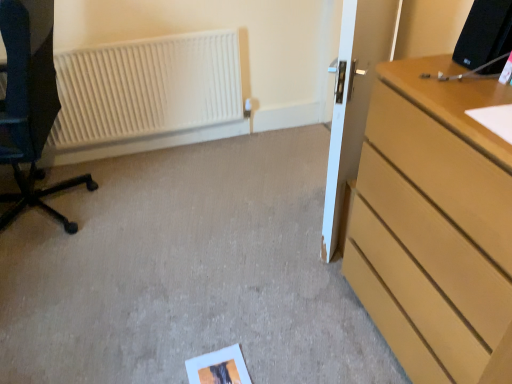
Question: From the image's perspective, is white glossy door at center on top of white matte radiator at upper left?

Choices:
 (A) no
 (B) yes

Answer: (A)

Question: Considering the relative sizes of white glossy door at center and white matte radiator at upper left in the image provided, is white glossy door at center thinner than white matte radiator at upper left?

Choices:
 (A) yes
 (B) no

Answer: (B)

Question: Is white glossy door at center positioned with its back to white matte radiator at upper left?

Choices:
 (A) no
 (B) yes

Answer: (A)

Question: Is white glossy door at center to the right of white matte radiator at upper left from the viewer's perspective?

Choices:
 (A) yes
 (B) no

Answer: (A)

Question: Would you consider white glossy door at center to be distant from white matte radiator at upper left?

Choices:
 (A) no
 (B) yes

Answer: (B)

Question: From the image's perspective, is matte black chair at left located above or below white glossy door at center?

Choices:
 (A) above
 (B) below

Answer: (A)

Question: Is matte black chair at left spatially inside white glossy door at center, or outside of it?

Choices:
 (A) outside
 (B) inside

Answer: (A)

Question: In terms of width, does matte black chair at left look wider or thinner when compared to white glossy door at center?

Choices:
 (A) thin
 (B) wide

Answer: (B)

Question: Relative to white glossy door at center, is matte black chair at left in front or behind?

Choices:
 (A) behind
 (B) front

Answer: (A)

Question: Looking at their shapes, would you say white matte radiator at upper left is wider or thinner than matte black chair at left?

Choices:
 (A) thin
 (B) wide

Answer: (A)

Question: Is white matte radiator at upper left bigger or smaller than matte black chair at left?

Choices:
 (A) small
 (B) big

Answer: (A)

Question: Is point (74, 61) positioned closer to the camera than point (29, 175)?

Choices:
 (A) farther
 (B) closer

Answer: (A)

Question: In the image, is white matte radiator at upper left on the left side or the right side of matte black chair at left?

Choices:
 (A) left
 (B) right

Answer: (B)

Question: Visually, is white matte radiator at upper left positioned to the left or to the right of light wood dresser at right?

Choices:
 (A) right
 (B) left

Answer: (B)

Question: Do you think white matte radiator at upper left is within light wood dresser at right, or outside of it?

Choices:
 (A) outside
 (B) inside

Answer: (A)